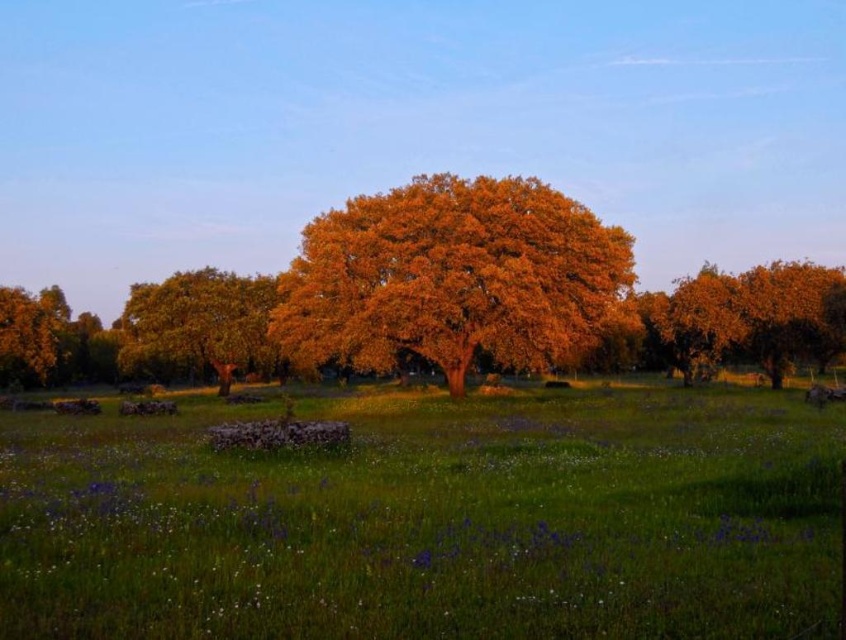
You are standing at the origin point in the image. Which direction should you walk to reach the green grassy field at center?

The green grassy field at center is located at point 0.816 on the x axis and 0.511 on the y axis, so you should walk towards the right and slightly forward to reach it.

You are standing at the edge of the green grassy field at center. You want to walk to the other side of the field. The field is 22.49 feet wide. If your average walking speed is 3 feet per second, how many seconds will it take you to cross the field?

The green grassy field at center is 22.49 feet wide. At a walking speed of 3 feet per second, it would take approximately 7.5 seconds to cross the field.

You are standing in the middle of the field and want to take a photo of both the golden textured tree at center and the golden textured tree at left. Which tree should you move closer to in order to include both in the frame without zooming in?

To include both the golden textured tree at center and the golden textured tree at left in the frame without zooming in, you should move closer to the golden textured tree at left since it is shorter than the golden textured tree at center, allowing you to fit both within the camera view by reducing the distance between yourself and the shorter tree.